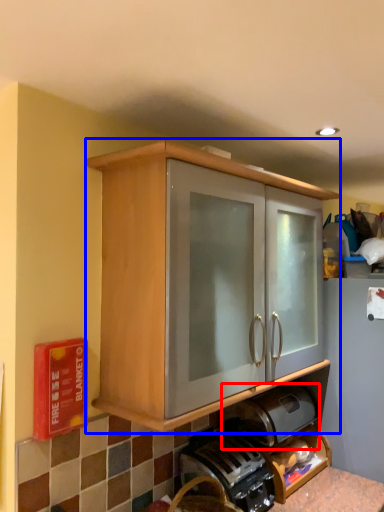
Question: Which object appears farthest to the camera in this image, appliance (highlighted by a red box) or cabinetry (highlighted by a blue box)?

Choices:
 (A) appliance
 (B) cabinetry

Answer: (A)